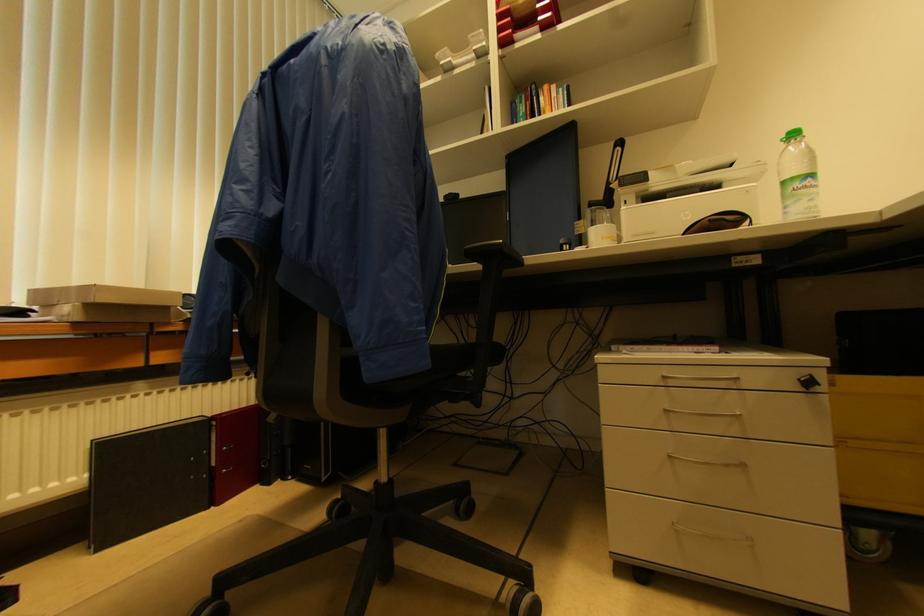
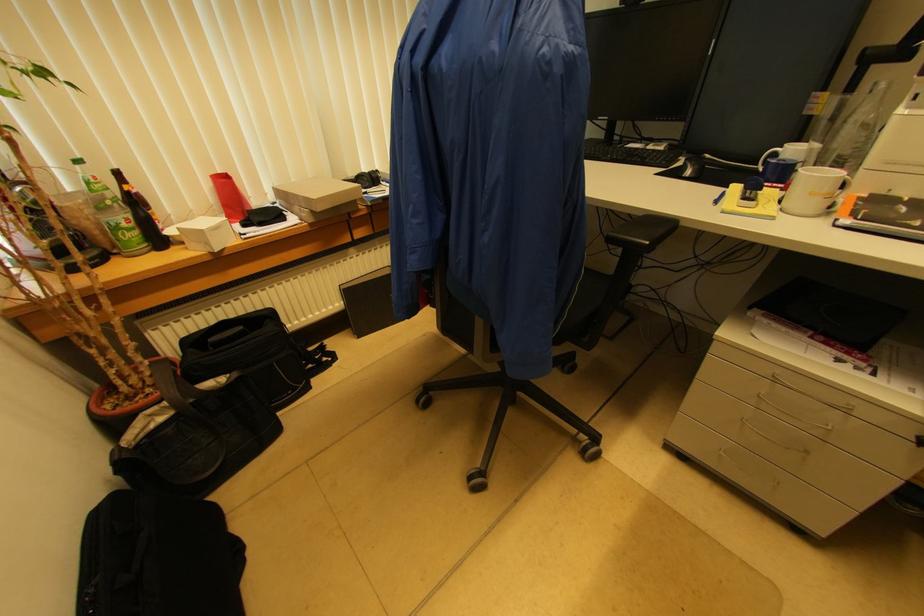
Where in the second image is the point corresponding to point 503,243 from the first image?

(650, 245)